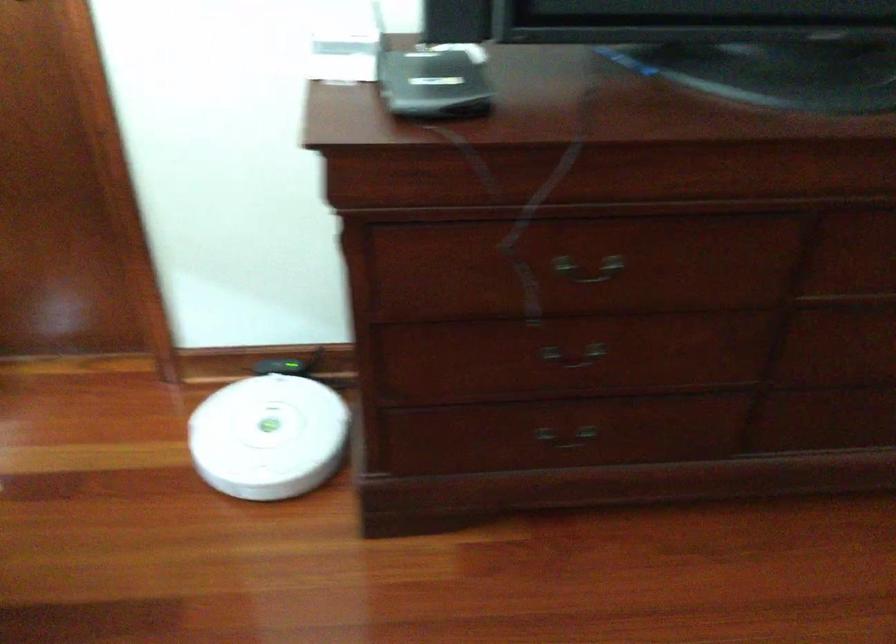
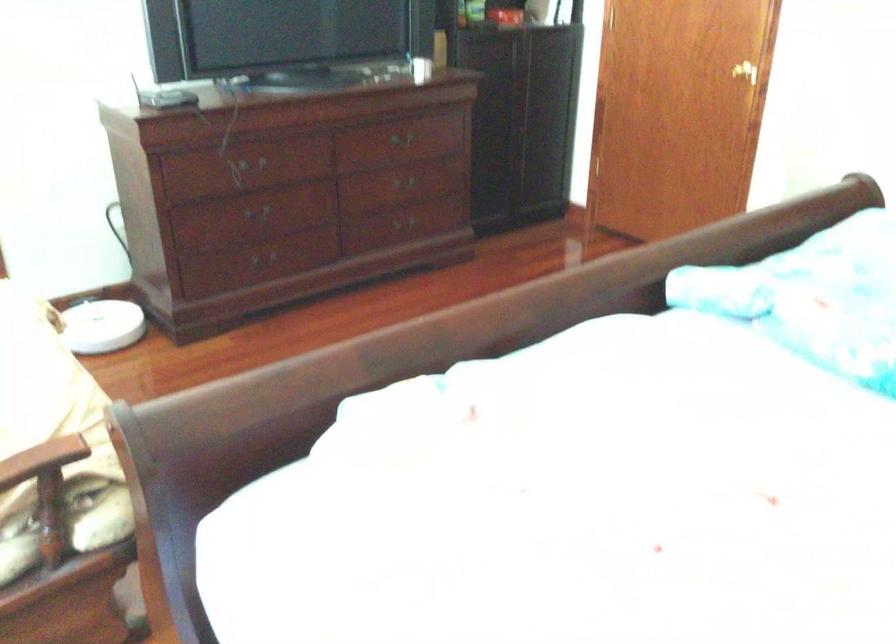
The point at (587, 341) is marked in the first image. Where is the corresponding point in the second image?

(255, 210)